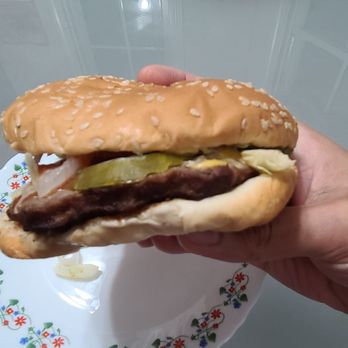
Identify the location of decrotive plate. Image resolution: width=348 pixels, height=348 pixels. (192, 333).